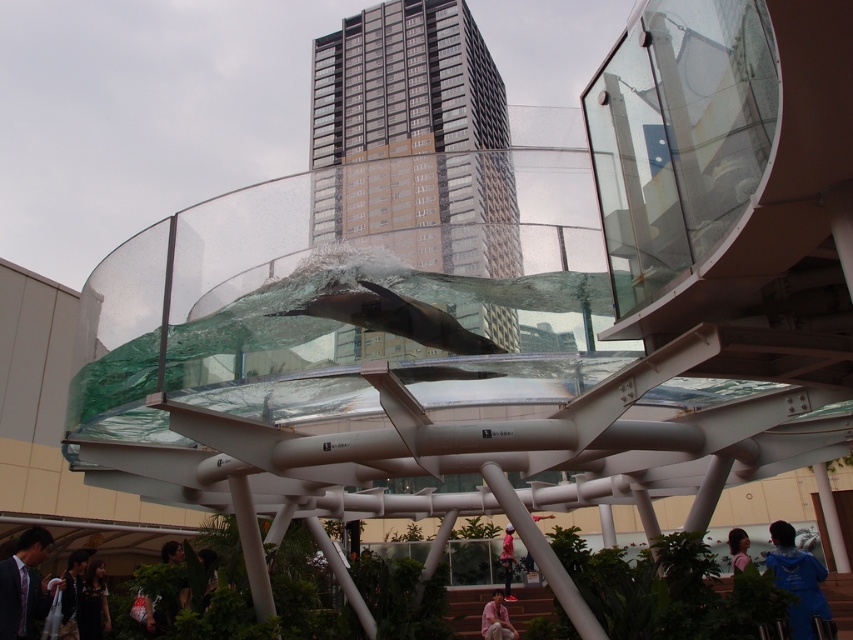
Question: Can you confirm if dark hair at lower left is positioned to the left of light pink fabric at lower center?

Choices:
 (A) yes
 (B) no

Answer: (A)

Question: Which of these objects is positioned closest to the light blue fabric person at lower center?

Choices:
 (A) dark suit at lower left
 (B) pink fabric at lower center
 (C) dark gray fabric jacket at lower left

Answer: (B)

Question: Considering the relative positions of dark hair at lower left and light pink fabric at lower center in the image provided, where is dark hair at lower left located with respect to light pink fabric at lower center?

Choices:
 (A) below
 (B) above

Answer: (A)

Question: Which of the following is the farthest from the observer?

Choices:
 (A) light pink fabric at lower center
 (B) blue fabric at lower right

Answer: (A)

Question: Where is dark suit at lower left located in relation to blue fabric at lower right in the image?

Choices:
 (A) right
 (B) left

Answer: (B)

Question: Which object is positioned farthest from the dark suit at lower left?

Choices:
 (A) light pink fabric at lower center
 (B) light blue fabric person at lower center
 (C) pink fabric at lower center
 (D) blue fabric at lower right

Answer: (B)